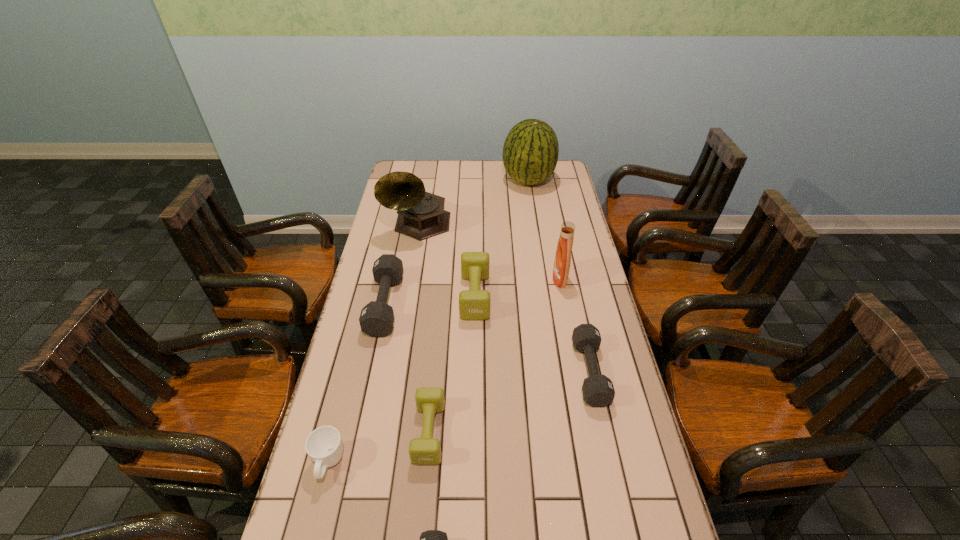
Locate an element on the screen. The image size is (960, 540). watermelon is located at coordinates [x=530, y=153].

The width and height of the screenshot is (960, 540). I want to click on green watermelon, so click(x=530, y=153).

The width and height of the screenshot is (960, 540). Find the location of `phonograph record`. phonograph record is located at coordinates (421, 215).

Locate an element on the screen. Image resolution: width=960 pixels, height=540 pixels. detergent is located at coordinates tap(562, 262).

This screenshot has width=960, height=540. I want to click on the fourth dumbbell from left to right, so click(x=474, y=304).

Find the location of a particular element. The width and height of the screenshot is (960, 540). the right olive dumbbell is located at coordinates (474, 304).

Where is `the biggest gray dumbbell`? Image resolution: width=960 pixels, height=540 pixels. the biggest gray dumbbell is located at coordinates (376, 319).

Locate an element on the screen. the leftmost dumbbell is located at coordinates (376, 319).

I want to click on cup, so coord(324,445).

Locate an element on the screen. the rightmost gray dumbbell is located at coordinates (598, 391).